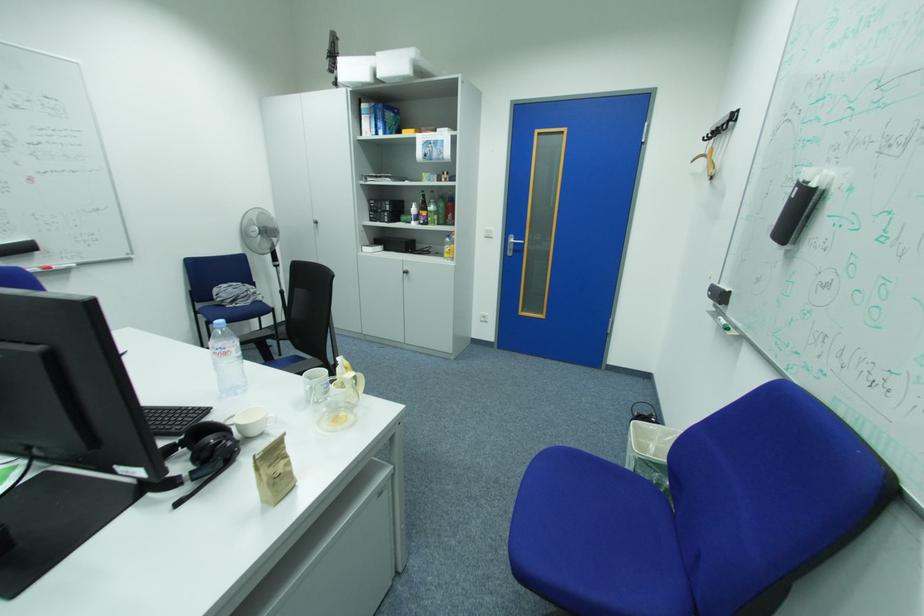
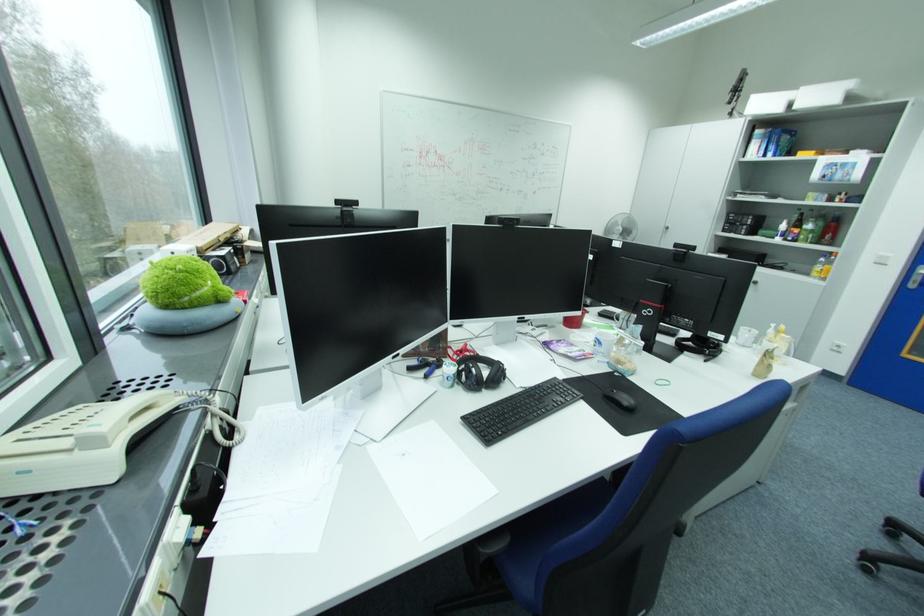
In the second image, find the point that corresponds to (x=415, y=273) in the first image.

(763, 283)